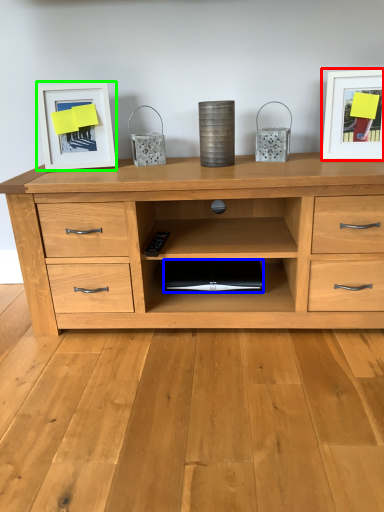
Question: Which object is positioned farthest from picture frame (highlighted by a red box)? Select from computer (highlighted by a blue box) and picture frame (highlighted by a green box).

Choices:
 (A) computer
 (B) picture frame

Answer: (B)